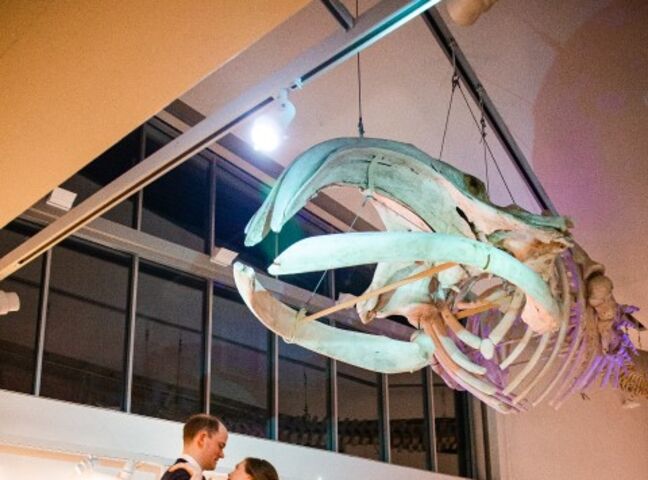
Locate an element on the screen. Image resolution: width=648 pixels, height=480 pixels. walls is located at coordinates (571, 442), (29, 463).